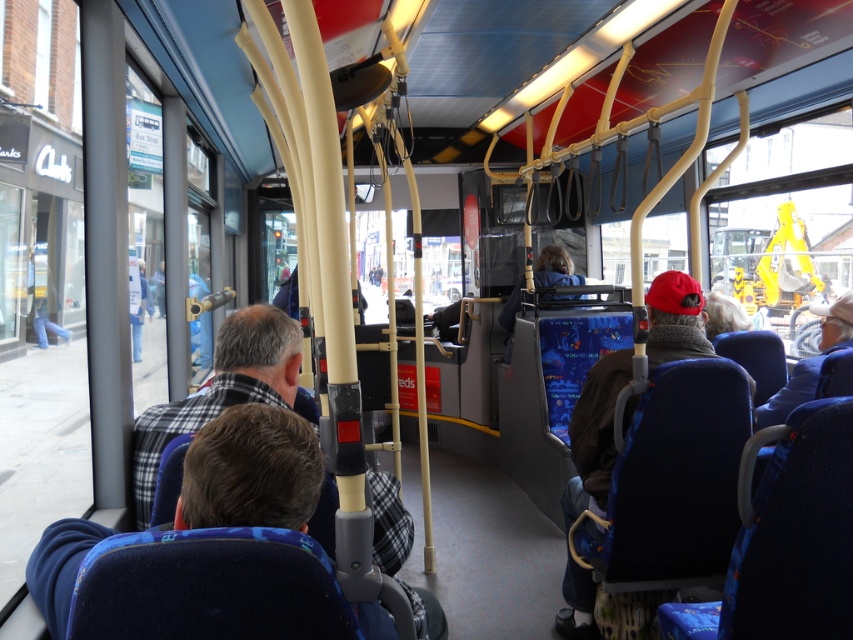
You are a passenger on the bus and want to know which of the two points, point (277,392) or point (608,449), is closer to you. Based on the image, which point is nearer?

Point (277,392) is closer to the camera than point (608,449), so it is the nearer one.

Looking at this image, you are standing inside the public bus and want to reach a destination that is near point (819, 352). You have two options to move towards it. One path goes through point (572, 506), and the other goes directly. Considering the bus layout described, which path would require you to walk a shorter distance?

The path going through point (572, 506) would require walking a shorter distance because point (572, 506) is closer to the viewer than point (819, 352). Since you are starting from your current position, moving towards the closer point first would result in a shorter overall path to reach the destination.